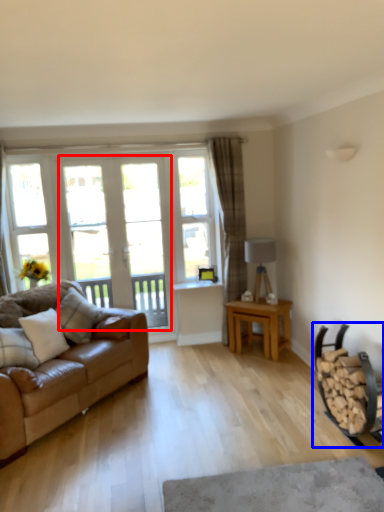
Question: Which object appears farthest to the camera in this image, screen door (highlighted by a red box) or armchair (highlighted by a blue box)?

Choices:
 (A) screen door
 (B) armchair

Answer: (A)